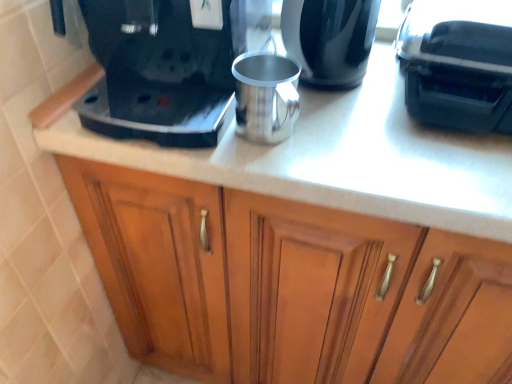
The width and height of the screenshot is (512, 384). Find the location of `vacant space in front of polished metal mug at center`. vacant space in front of polished metal mug at center is located at coordinates (289, 173).